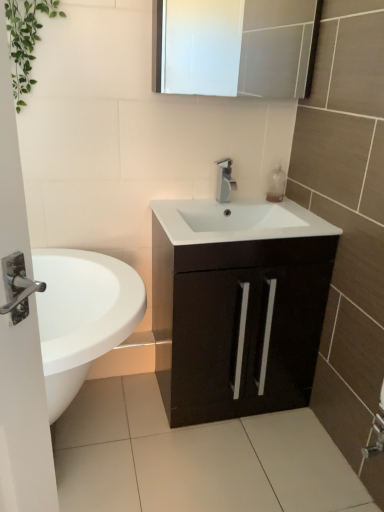
Find the location of a particular element. Image resolution: width=384 pixels, height=512 pixels. vacant space in front of translucent plastic soap dispenser at upper right is located at coordinates (284, 211).